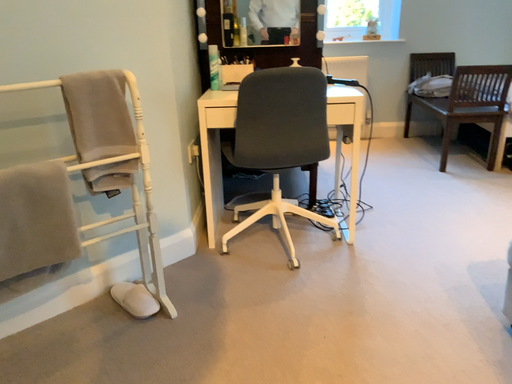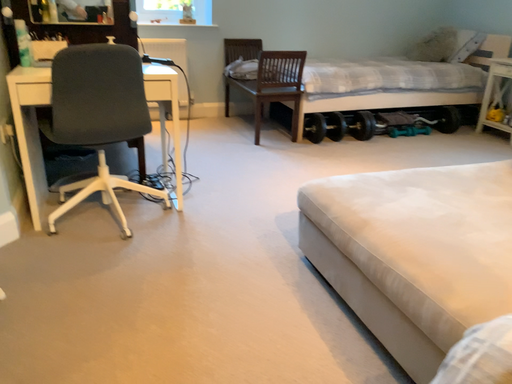
Question: How did the camera likely rotate when shooting the video?

Choices:
 (A) rotated right
 (B) rotated left

Answer: (A)